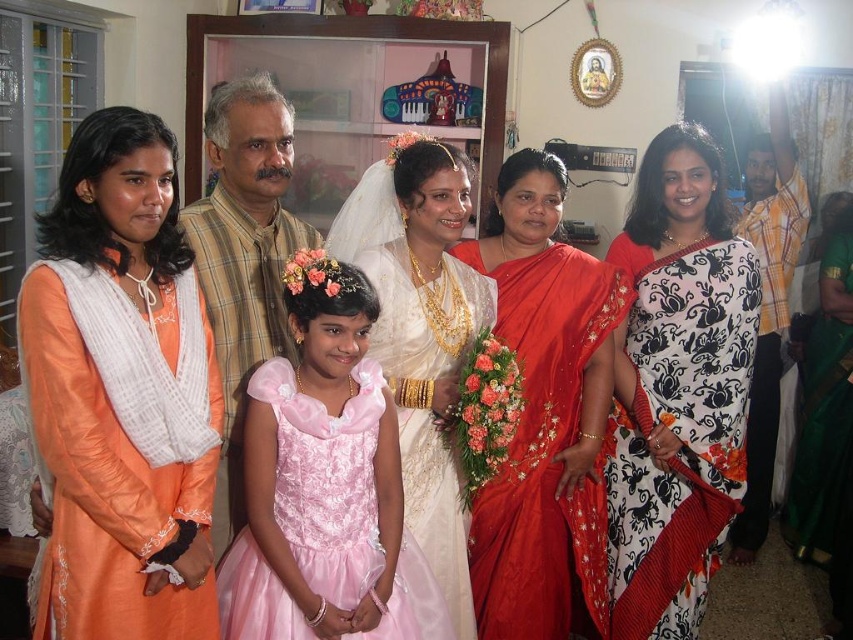
Does shiny red saree at center appear over light brown plaid shirt at center?

No, shiny red saree at center is not above light brown plaid shirt at center.

In the scene shown: Who is positioned more to the left, shiny red saree at center or light brown plaid shirt at center?

Positioned to the left is light brown plaid shirt at center.

Who is more forward, (537, 355) or (202, 292)?

Point (202, 292) is in front.

This screenshot has width=853, height=640. I want to click on shiny red saree at center, so click(x=544, y=416).

Is orange silk kurta at left shorter than pink satin dress at center?

No, orange silk kurta at left is not shorter than pink satin dress at center.

Is point (181, 573) positioned in front of point (363, 321)?

Yes, point (181, 573) is closer to viewer.

Is point (111, 604) in front of point (268, 468)?

Yes, it is.

Image resolution: width=853 pixels, height=640 pixels. In order to click on orange silk kurta at left in this screenshot , I will do `click(120, 392)`.

Does orange silk kurta at left appear on the right side of white printed saree at center?

In fact, orange silk kurta at left is to the left of white printed saree at center.

Find the location of a particular element. orange silk kurta at left is located at coordinates (120, 392).

Is point (97, 268) farther from viewer compared to point (641, 577)?

No, it is in front of (641, 577).

The width and height of the screenshot is (853, 640). In order to click on orange silk kurta at left in this screenshot , I will do `click(120, 392)`.